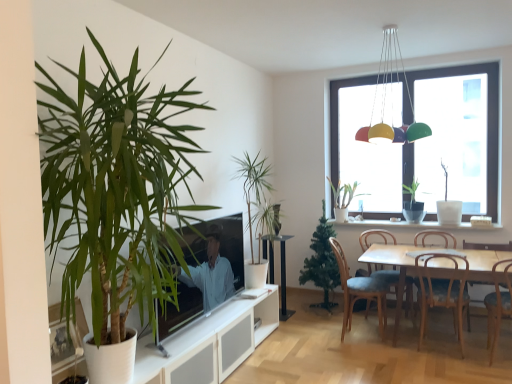
Question: Considering the relative positions of white matte vase at right, which is the sixth houseplant from left to right, and wooden chair at lower right, positioned as the 3th chair in right-to-left order, in the image provided, is white matte vase at right, which is the sixth houseplant from left to right, to the right of wooden chair at lower right, positioned as the 3th chair in right-to-left order, from the viewer's perspective?

Choices:
 (A) yes
 (B) no

Answer: (A)

Question: Is white matte vase at right, which is the 3th houseplant in back-to-front order, not within wooden chair at lower right, positioned as the 3th chair in right-to-left order?

Choices:
 (A) yes
 (B) no

Answer: (A)

Question: From a real-world perspective, is white matte vase at right, which is the sixth houseplant from left to right, on wooden chair at lower right, the third chair positioned from the left?

Choices:
 (A) yes
 (B) no

Answer: (A)

Question: Does white matte vase at right, which appears as the 4th houseplant when viewed from the front, have a lesser width compared to wooden chair at lower right, the third chair positioned from the left?

Choices:
 (A) yes
 (B) no

Answer: (A)

Question: Can you confirm if white matte vase at right, placed as the first houseplant when sorted from right to left, is wider than wooden chair at lower right, positioned as the 3th chair in right-to-left order?

Choices:
 (A) no
 (B) yes

Answer: (A)

Question: From the image's perspective, is white matte vase at right, which is the 3th houseplant in back-to-front order, positioned above or below transparent glass window at upper right?

Choices:
 (A) above
 (B) below

Answer: (B)

Question: Considering the positions of white matte vase at right, which appears as the 4th houseplant when viewed from the front, and transparent glass window at upper right in the image, is white matte vase at right, which appears as the 4th houseplant when viewed from the front, taller or shorter than transparent glass window at upper right?

Choices:
 (A) tall
 (B) short

Answer: (B)

Question: Visually, is white matte vase at right, which appears as the 4th houseplant when viewed from the front, positioned to the left or to the right of transparent glass window at upper right?

Choices:
 (A) left
 (B) right

Answer: (B)

Question: From a real-world perspective, is white matte vase at right, which appears as the 4th houseplant when viewed from the front, above or below transparent glass window at upper right?

Choices:
 (A) below
 (B) above

Answer: (A)

Question: From the image's perspective, is transparent glass window at upper right located above or below white ceramic window sill at center?

Choices:
 (A) below
 (B) above

Answer: (B)

Question: Is transparent glass window at upper right in front of or behind white ceramic window sill at center in the image?

Choices:
 (A) behind
 (B) front

Answer: (A)

Question: From a real-world perspective, is transparent glass window at upper right above or below white ceramic window sill at center?

Choices:
 (A) below
 (B) above

Answer: (B)

Question: In terms of width, does transparent glass window at upper right look wider or thinner when compared to white ceramic window sill at center?

Choices:
 (A) thin
 (B) wide

Answer: (A)

Question: Considering the positions of wooden chair at lower right, which is counted as the 5th chair, starting from the left, and green matte plant at window, the 5th houseplant when ordered from left to right, in the image, is wooden chair at lower right, which is counted as the 5th chair, starting from the left, bigger or smaller than green matte plant at window, the 5th houseplant when ordered from left to right,?

Choices:
 (A) big
 (B) small

Answer: (A)

Question: Considering the positions of point (494, 246) and point (413, 221), is point (494, 246) closer or farther from the camera than point (413, 221)?

Choices:
 (A) farther
 (B) closer

Answer: (B)